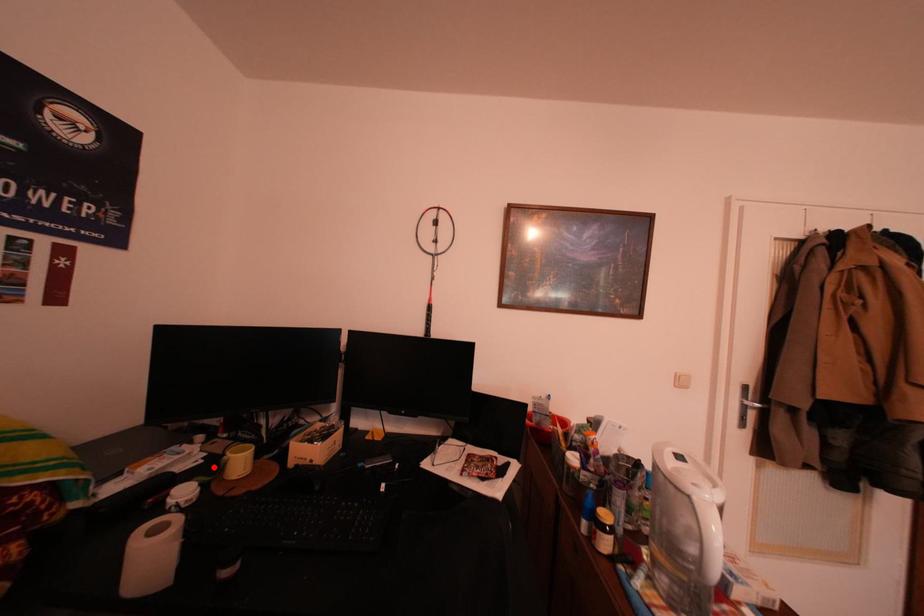
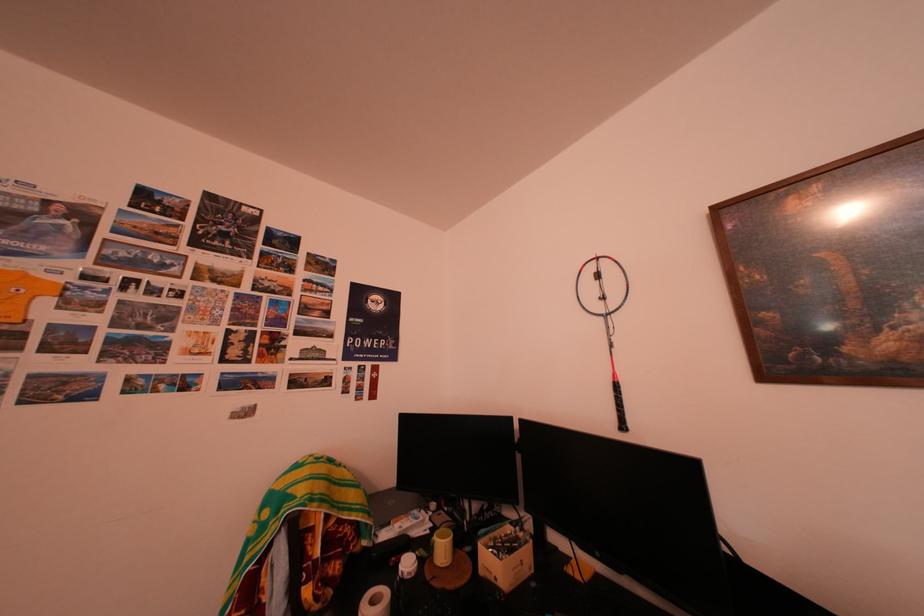
Find the pixel in the second image that matches the highlighted location in the first image.

(441, 537)